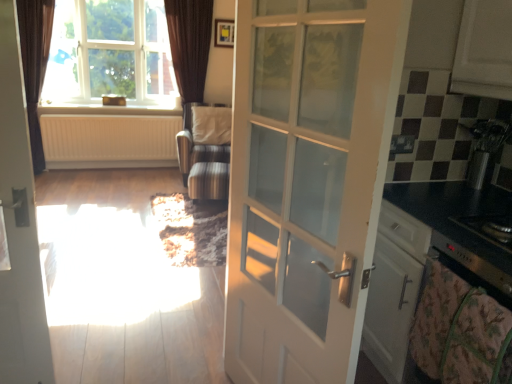
Question: Is brown velvet curtain at upper left at the left side of floral cotton blanket at lower right?

Choices:
 (A) yes
 (B) no

Answer: (A)

Question: Is brown velvet curtain at upper left outside of floral cotton blanket at lower right?

Choices:
 (A) yes
 (B) no

Answer: (A)

Question: From the image's perspective, does brown velvet curtain at upper left appear lower than floral cotton blanket at lower right?

Choices:
 (A) no
 (B) yes

Answer: (A)

Question: Does brown velvet curtain at upper left appear on the right side of floral cotton blanket at lower right?

Choices:
 (A) no
 (B) yes

Answer: (A)

Question: From a real-world perspective, is brown velvet curtain at upper left below floral cotton blanket at lower right?

Choices:
 (A) yes
 (B) no

Answer: (B)

Question: Considering the relative sizes of brown velvet curtain at upper left and floral cotton blanket at lower right in the image provided, is brown velvet curtain at upper left taller than floral cotton blanket at lower right?

Choices:
 (A) yes
 (B) no

Answer: (A)

Question: Is white glossy door at left, the 1th door in the left-to-right sequence, turned away from black glass stove at right, arranged as the first appliance when viewed from the front?

Choices:
 (A) no
 (B) yes

Answer: (A)

Question: From a real-world perspective, does white glossy door at left, the 1th door in the left-to-right sequence, stand above black glass stove at right, the first appliance in the bottom-to-top sequence?

Choices:
 (A) yes
 (B) no

Answer: (B)

Question: Would you say white glossy door at left, the 1th door in the left-to-right sequence, contains black glass stove at right, the first appliance in the bottom-to-top sequence?

Choices:
 (A) yes
 (B) no

Answer: (B)

Question: Can you confirm if white glossy door at left, the 1th door in the left-to-right sequence, is thinner than black glass stove at right, arranged as the first appliance when viewed from the front?

Choices:
 (A) no
 (B) yes

Answer: (B)

Question: From the image's perspective, does white glossy door at left, the 1th door in the left-to-right sequence, appear lower than black glass stove at right, placed as the second appliance when sorted from back to front?

Choices:
 (A) yes
 (B) no

Answer: (B)

Question: Is white glossy door at left, the 1th door in the left-to-right sequence, beside black glass stove at right, the first appliance in the bottom-to-top sequence?

Choices:
 (A) yes
 (B) no

Answer: (B)

Question: Is brown velvet curtain at upper left not close to clear glass window at upper left?

Choices:
 (A) yes
 (B) no

Answer: (B)